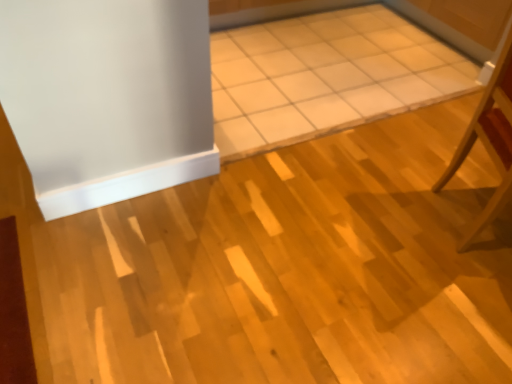
Where is `free space underneath wooden folding chair at right (from a real-world perspective)`? This screenshot has width=512, height=384. free space underneath wooden folding chair at right (from a real-world perspective) is located at coordinates pyautogui.click(x=462, y=211).